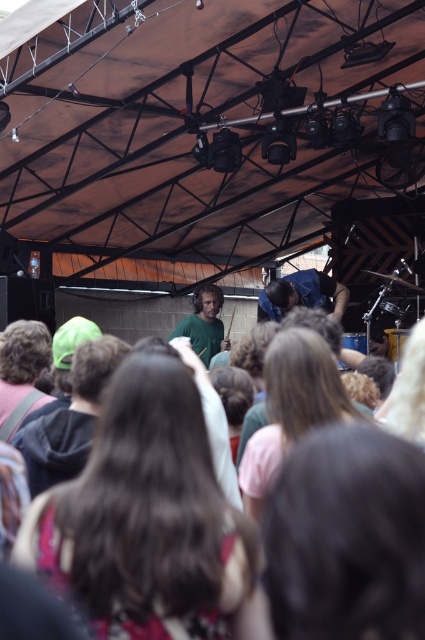
Which is in front, point (391, 605) or point (294, 278)?

Point (391, 605) is more forward.

Who is positioned more to the right, brown hair at center or blue fabric shirt at center?

blue fabric shirt at center

Is point (402, 564) more distant than point (346, 294)?

No, (402, 564) is closer to viewer.

Find the location of `brown hair at center`. brown hair at center is located at coordinates (345, 540).